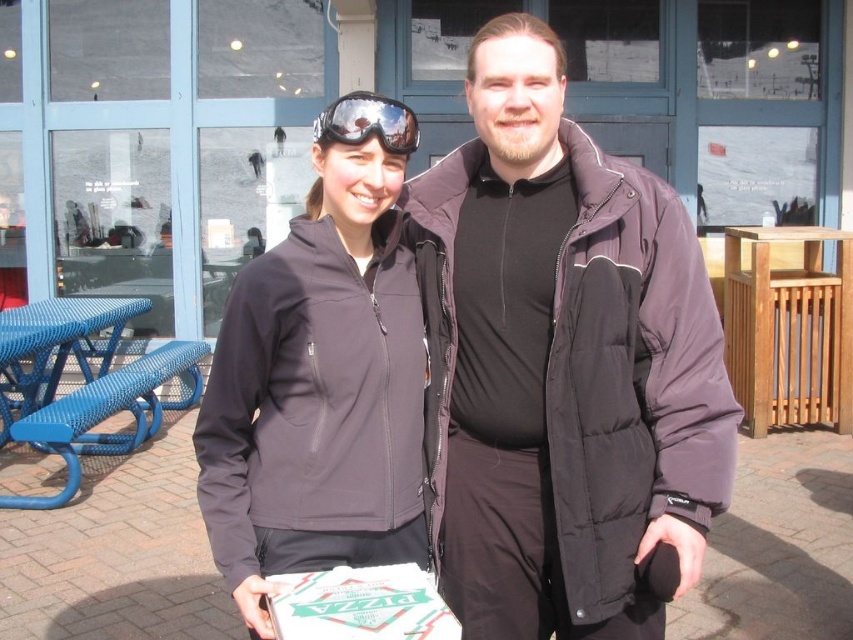
Between blue woven picnic table at left and reflective plastic goggles at center, which one is positioned higher?

reflective plastic goggles at center

The height and width of the screenshot is (640, 853). Identify the location of blue woven picnic table at left. (105, 413).

Describe the element at coordinates (321, 376) in the screenshot. I see `dark gray softshell jacket at center` at that location.

Who is lower down, dark gray softshell jacket at center or reflective plastic goggles at center?

dark gray softshell jacket at center

Between point (227, 340) and point (328, 109), which one is positioned behind?

The point (328, 109) is behind.

Locate an element on the screen. The height and width of the screenshot is (640, 853). dark gray softshell jacket at center is located at coordinates (321, 376).

In order to click on purple puffy jacket at center in this screenshot , I will do `click(561, 364)`.

Is point (437, 435) farther from camera compared to point (73, 298)?

No, (437, 435) is in front of (73, 298).

Find the location of a particular element. This screenshot has width=853, height=640. purple puffy jacket at center is located at coordinates (561, 364).